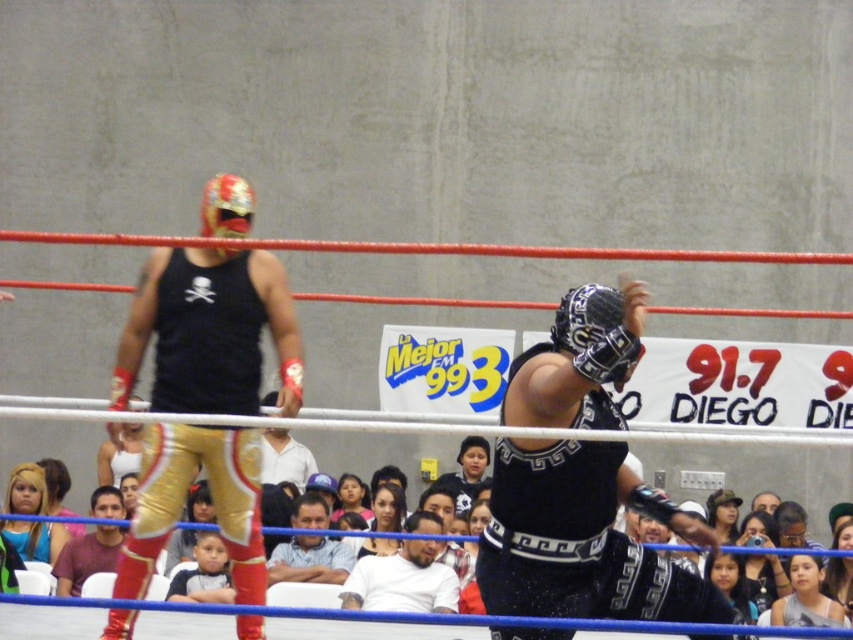
You are a photographer standing at the edge of the wrestling ring. You want to take a closeup photo of both the black satin mask at center and the white matte shirt at center. Given that your camera has a maximum focus range of 15 meters, will you be able to capture both subjects clearly in the same photo?

The black satin mask at center is 15.14 meters away from the white matte shirt at center. Since the distance between them exceeds the camera maximum focus range of 15 meters, you won not be able to capture both subjects clearly in the same photo.

You are a photographer in the front row of the wrestling match. You notice the black satin mask at center and the white matte shirt at center. Which object is positioned higher in the image?

The black satin mask at center is located above the white matte shirt at center, so it is positioned higher in the image.